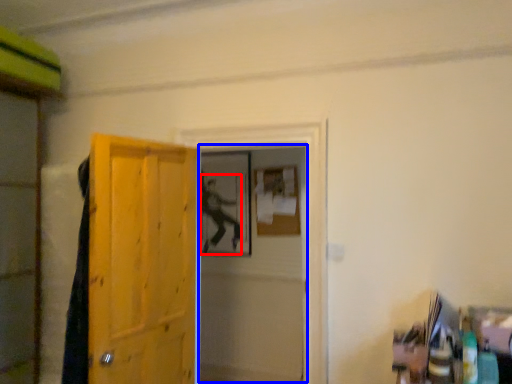
Question: Among these objects, which one is nearest to the camera, person (highlighted by a red box) or screen door (highlighted by a blue box)?

Choices:
 (A) person
 (B) screen door

Answer: (B)